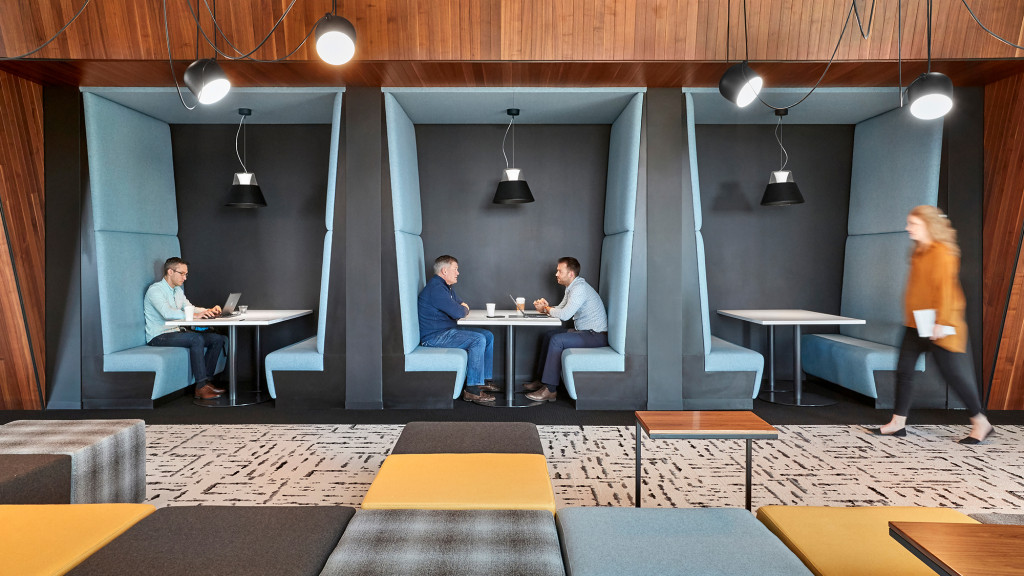
Find the location of a particular element. Image resolution: width=1024 pixels, height=576 pixels. lighting is located at coordinates (748, 92).